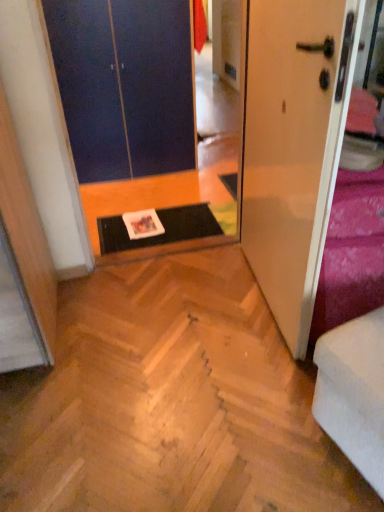
Where is `white fabric armchair at lower right`? white fabric armchair at lower right is located at coordinates (354, 393).

At what (x,y) coordinates should I click in order to perform the action: click on blue matte door at upper left, the first door viewed from the left. Please return your answer as a coordinate pair (x, y). Looking at the image, I should click on (124, 85).

Consider the image. What is the approximate width of natural wood parquet floor at center?

natural wood parquet floor at center is 4.77 feet in width.

Image resolution: width=384 pixels, height=512 pixels. Describe the element at coordinates (170, 402) in the screenshot. I see `natural wood parquet floor at center` at that location.

Where is `white fabric armchair at lower right`? The height and width of the screenshot is (512, 384). white fabric armchair at lower right is located at coordinates (354, 393).

From a real-world perspective, is white fabric armchair at lower right below velvet purple bedding at right?

Yes, from a real-world perspective, white fabric armchair at lower right is below velvet purple bedding at right.

Does white fabric armchair at lower right have a greater width compared to velvet purple bedding at right?

Correct, the width of white fabric armchair at lower right exceeds that of velvet purple bedding at right.

Could you tell me if white fabric armchair at lower right is turned towards velvet purple bedding at right?

No, white fabric armchair at lower right is not turned towards velvet purple bedding at right.

From the image's perspective, is white fabric armchair at lower right positioned above or below velvet purple bedding at right?

white fabric armchair at lower right is below velvet purple bedding at right.

In terms of width, does natural wood parquet floor at center look wider or thinner when compared to black rubber doormat at center?

natural wood parquet floor at center is wider than black rubber doormat at center.

Between point (149, 311) and point (196, 234), which one is positioned behind?

The point (196, 234) is farther from the camera.

Is natural wood parquet floor at center further to camera compared to black rubber doormat at center?

No, natural wood parquet floor at center is in front of black rubber doormat at center.

Is natural wood parquet floor at center surrounded by velvet purple bedding at right?

No, natural wood parquet floor at center is not inside velvet purple bedding at right.

Can you confirm if velvet purple bedding at right is wider than natural wood parquet floor at center?

Incorrect, the width of velvet purple bedding at right does not surpass that of natural wood parquet floor at center.

Between velvet purple bedding at right and natural wood parquet floor at center, which one has larger size?

Bigger between the two is velvet purple bedding at right.

Is velvet purple bedding at right positioned with its back to natural wood parquet floor at center?

No, velvet purple bedding at right is not facing away from natural wood parquet floor at center.

Based on the photo, which object is closer to the camera taking this photo, black rubber doormat at center or white fabric armchair at lower right?

white fabric armchair at lower right.

Is black rubber doormat at center beside white fabric armchair at lower right?

black rubber doormat at center and white fabric armchair at lower right are clearly separated.

Is black rubber doormat at center surrounding white fabric armchair at lower right?

No, white fabric armchair at lower right is not inside black rubber doormat at center.

From the image's perspective, which one is positioned higher, natural wood parquet floor at center or white glossy door at right, the second door positioned from the left?

white glossy door at right, the second door positioned from the left.

Is natural wood parquet floor at center directly adjacent to white glossy door at right, the 1th door from the right?

No, natural wood parquet floor at center is not with white glossy door at right, the 1th door from the right.

Looking at their sizes, would you say natural wood parquet floor at center is wider or thinner than white glossy door at right, the second door from the back?

natural wood parquet floor at center is wider than white glossy door at right, the second door from the back.

From a real-world perspective, does white fabric armchair at lower right sit lower than black rubber doormat at center?

No, from a real-world perspective, white fabric armchair at lower right is not beneath black rubber doormat at center.

How distant is white fabric armchair at lower right from black rubber doormat at center?

white fabric armchair at lower right is 4.58 feet from black rubber doormat at center.

Is point (373, 440) farther from viewer compared to point (179, 237)?

No, it is not.

Is white fabric armchair at lower right in front of or behind black rubber doormat at center in the image?

In the image, white fabric armchair at lower right appears in front of black rubber doormat at center.

From the picture: Which is nearer, (281, 99) or (364, 470)?

Point (281, 99) is positioned farther from the camera compared to point (364, 470).

In the image, is white glossy door at right, the second door positioned from the left, on the left side or the right side of white fabric armchair at lower right?

Based on their positions, white glossy door at right, the second door positioned from the left, is located to the left of white fabric armchair at lower right.

Can we say white glossy door at right, the first door viewed from the front, lies outside white fabric armchair at lower right?

That's correct, white glossy door at right, the first door viewed from the front, is outside of white fabric armchair at lower right.

Consider the image. From a real-world perspective, between white glossy door at right, the first door viewed from the front, and white fabric armchair at lower right, who is vertically higher?

In real-world perspective, white glossy door at right, the first door viewed from the front, is above.

I want to click on bedding above the white fabric armchair at lower right (from the image's perspective), so click(x=351, y=252).

I want to click on stairwell that appears on the right of black rubber doormat at center, so click(x=170, y=402).

Based on their spatial positions, is white glossy door at right, the second door positioned from the left, or blue matte door at upper left, the 2th door positioned from the front, closer to black rubber doormat at center?

blue matte door at upper left, the 2th door positioned from the front, lies closer to black rubber doormat at center than the other object.

Looking at this image, which object lies further to the anchor point white fabric armchair at lower right, white glossy door at right, the first door viewed from the front, or black rubber doormat at center?

black rubber doormat at center.

Based on their spatial positions, is black rubber doormat at center or white glossy door at right, the second door positioned from the left, further from velvet purple bedding at right?

black rubber doormat at center is further to velvet purple bedding at right.

From the image, which object appears to be nearer to blue matte door at upper left, which ranks as the 2th door in right-to-left order, natural wood parquet floor at center or velvet purple bedding at right?

natural wood parquet floor at center lies closer to blue matte door at upper left, which ranks as the 2th door in right-to-left order, than the other object.

When comparing their distances from white glossy door at right, the first door viewed from the front, does black rubber doormat at center or natural wood parquet floor at center seem closer?

Among the two, natural wood parquet floor at center is located nearer to white glossy door at right, the first door viewed from the front.

From the image, which object appears to be farther from white glossy door at right, the 1th door from the right, blue matte door at upper left, which ranks as the 2th door in right-to-left order, or velvet purple bedding at right?

blue matte door at upper left, which ranks as the 2th door in right-to-left order, is positioned further to the anchor white glossy door at right, the 1th door from the right.

Estimate the real-world distances between objects in this image. Which object is further from velvet purple bedding at right, blue matte door at upper left, which ranks as the 2th door in right-to-left order, or black rubber doormat at center?

blue matte door at upper left, which ranks as the 2th door in right-to-left order.

Looking at the image, which one is located further to blue matte door at upper left, which ranks as the 2th door in right-to-left order, white glossy door at right, the second door positioned from the left, or black rubber doormat at center?

white glossy door at right, the second door positioned from the left, is positioned further to the anchor blue matte door at upper left, which ranks as the 2th door in right-to-left order.

Identify the location of stairwell positioned between white fabric armchair at lower right and black rubber doormat at center from near to far. (170, 402).

You are a GUI agent. You are given a task and a screenshot of the screen. Output one action in this format:
    pyautogui.click(x=<x>, y=<y>)
    Task: Click on the stairwell between white glossy door at right, the 1th door from the right, and black rubber doormat at center from front to back
    Image resolution: width=384 pixels, height=512 pixels.
    Given the screenshot: What is the action you would take?
    pyautogui.click(x=170, y=402)

The image size is (384, 512). I want to click on bedding between white glossy door at right, the second door from the back, and white fabric armchair at lower right from top to bottom, so click(351, 252).

This screenshot has width=384, height=512. I want to click on bedding positioned between white glossy door at right, the 1th door from the right, and black rubber doormat at center from near to far, so click(x=351, y=252).